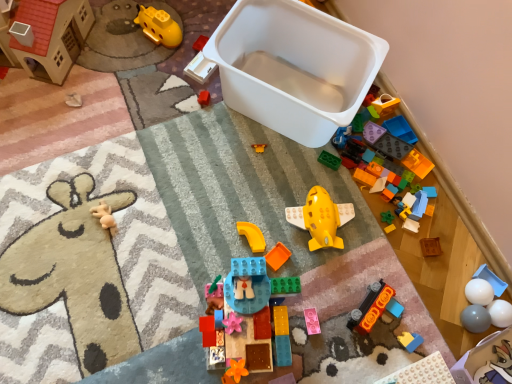
The height and width of the screenshot is (384, 512). I want to click on free space to the left of yellow matte airplane at center, the 8th toy from the left, so click(x=250, y=211).